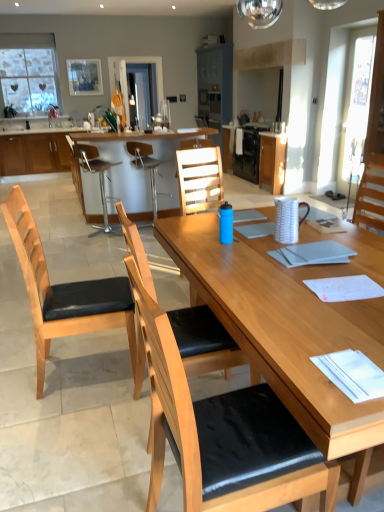
The height and width of the screenshot is (512, 384). I want to click on vacant space positioned to the left of wooden chair with black cushion at center, marked as the fourth chair in a back-to-front arrangement, so click(96, 429).